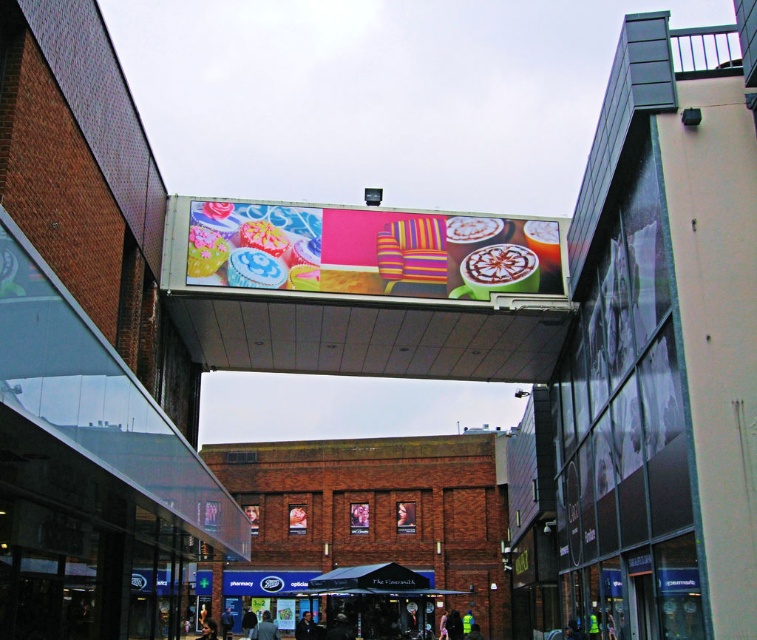
You are a delivery person carrying a package that requires a clear path of 25 meters to move through the walkway. You see the vibrant digital billboard at center and the black fabric canopy at center. Can you safely navigate through the space between them without needing to adjust your path?

The vibrant digital billboard at center is 25.78 meters from the black fabric canopy at center. Since your required clear path is 25 meters, you can safely navigate through the space between them without needing to adjust your path as the distance is sufficient.

You are standing at the entrance of the walkway and want to find the black fabric canopy at center. According to the scene description, where should you look relative to the large digital billboard?

The black fabric canopy at center is located at point (369, 579), which is directly below the large digital billboard since it is at the center of the walkway.